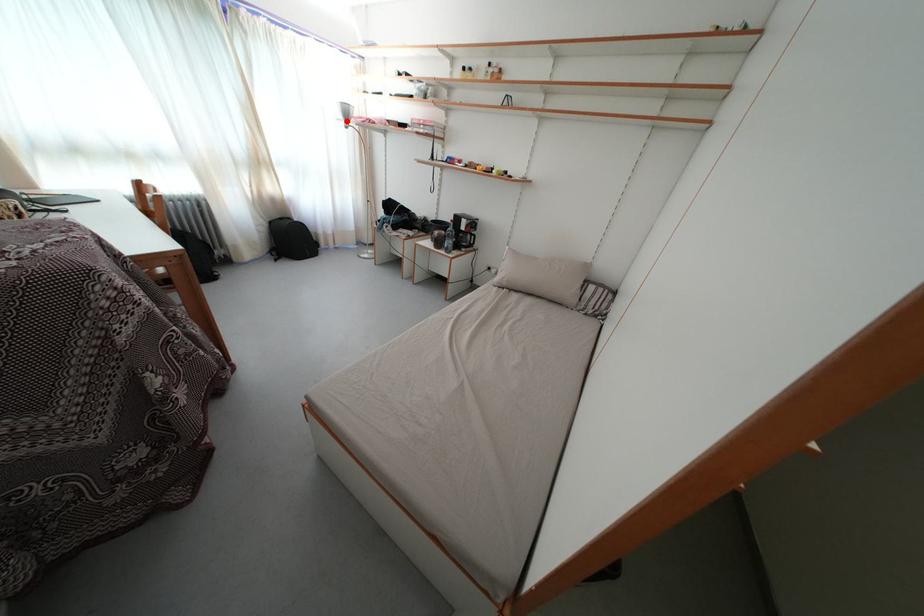
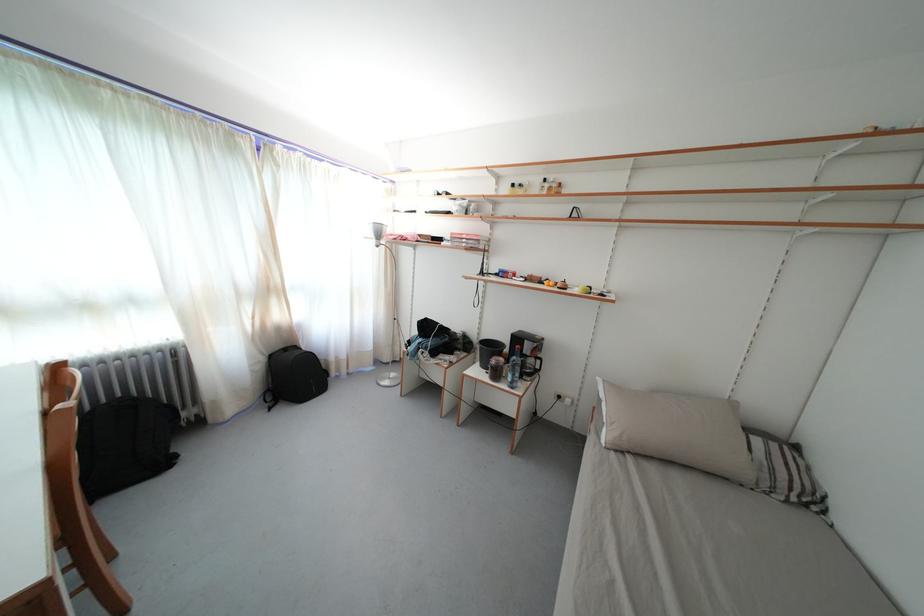
Locate, in the second image, the point that corresponds to the highlighted location in the first image.

(378, 241)